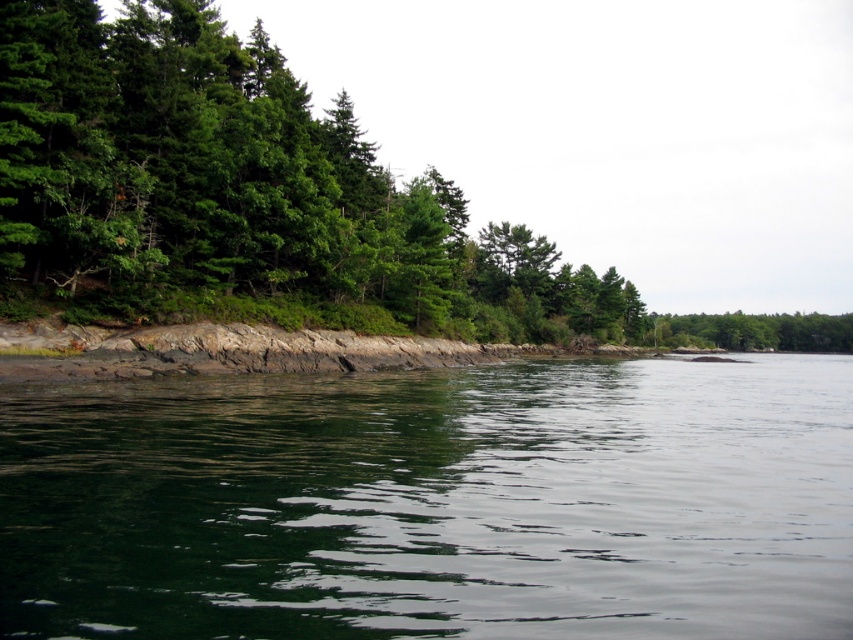
Between green reflective water at center and green matte tree at center, which one appears on the right side from the viewer's perspective?

From the viewer's perspective, green matte tree at center appears more on the right side.

Can you confirm if green reflective water at center is bigger than green matte tree at center?

Actually, green reflective water at center might be smaller than green matte tree at center.

Does point (322, 602) come closer to viewer compared to point (805, 349)?

Yes, it is.

Identify the location of green reflective water at center. (434, 502).

Is green matte trees at left to the right of green matte tree at center from the viewer's perspective?

Incorrect, green matte trees at left is not on the right side of green matte tree at center.

Is green matte trees at left thinner than green matte tree at center?

Yes.

Between point (405, 198) and point (711, 324), which one is positioned behind?

The point (711, 324) is more distant.

Image resolution: width=853 pixels, height=640 pixels. Find the location of `green matte trees at left`. green matte trees at left is located at coordinates click(239, 188).

Between green reflective water at center and green matte trees at left, which one has less height?

green reflective water at center

Is point (666, 636) positioned behind point (128, 12)?

That is False.

I want to click on green reflective water at center, so click(434, 502).